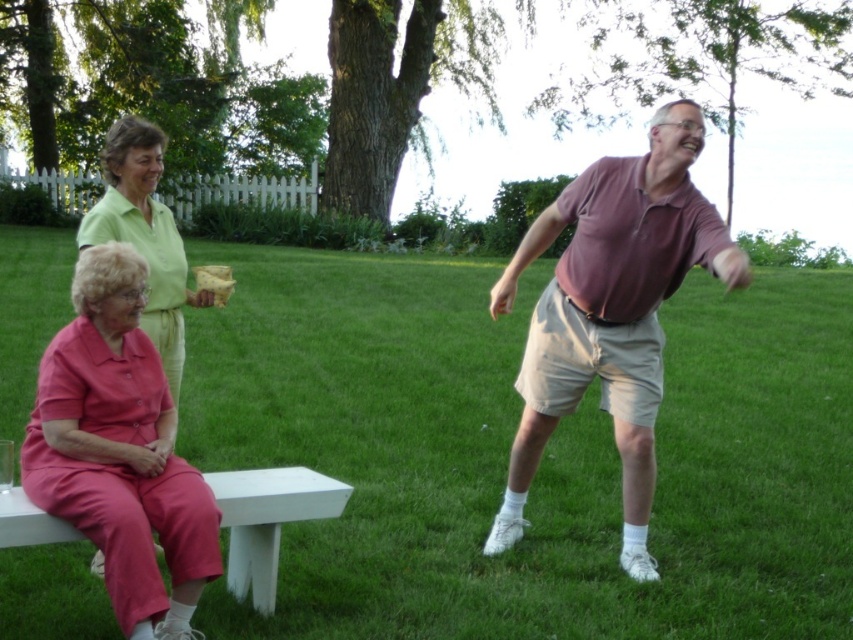
You are a photographer setting up a tripod to capture a closeup of the pink fabric pants at lower left and the white matte bench at lower left. The tripod requires at least 18 inches of space between the two objects to frame them properly. Based on the scene, will you have enough space?

The distance between the pink fabric pants at lower left and the white matte bench at lower left is 20.24 inches, which is more than the required 18 inches. Therefore, the photographer will have sufficient space to set up the tripod and frame both objects properly.

You are standing at the center of the image and want to place a small potted plant exactly at point (611,310). What object will the plant be placed on top of?

The small potted plant will be placed on top of the matte purple shirt at center located at point (611,310).

You are standing in the park and see two points marked in the image. Which point is closer to you, point (509, 524) or point (148, 388)?

Point (148, 388) is closer to you because it is less further to the viewer than point (509, 524).